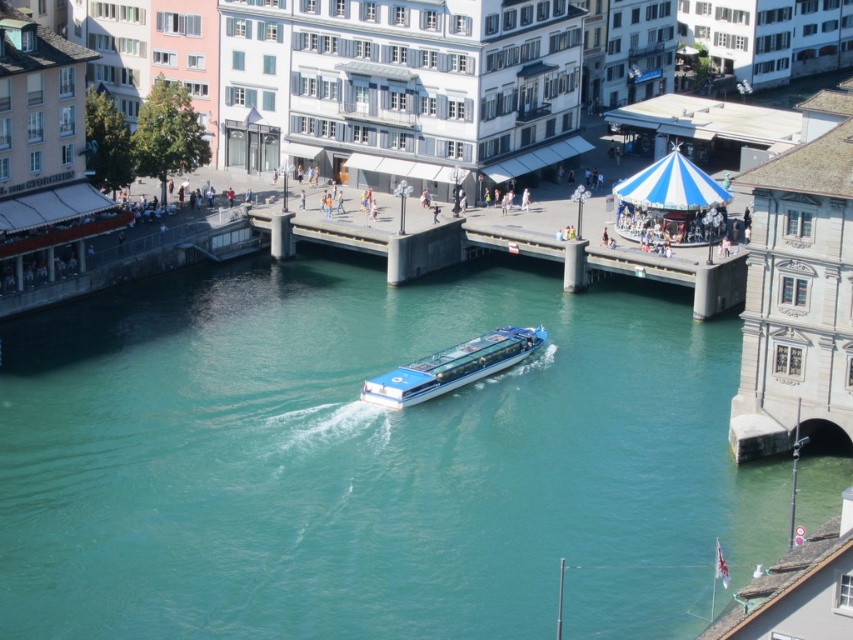
Question: Is teal glossy water at center below blue glossy boat at center?

Choices:
 (A) yes
 (B) no

Answer: (A)

Question: Which of the following is the closest to the observer?

Choices:
 (A) (627, 412)
 (B) (456, 348)

Answer: (A)

Question: Where is teal glossy water at center located in relation to blue glossy boat at center in the image?

Choices:
 (A) left
 (B) right

Answer: (A)

Question: Observing the image, what is the correct spatial positioning of teal glossy water at center in reference to blue glossy boat at center?

Choices:
 (A) left
 (B) right

Answer: (A)

Question: Which object is closer to the camera taking this photo?

Choices:
 (A) blue glossy boat at center
 (B) teal glossy water at center

Answer: (B)